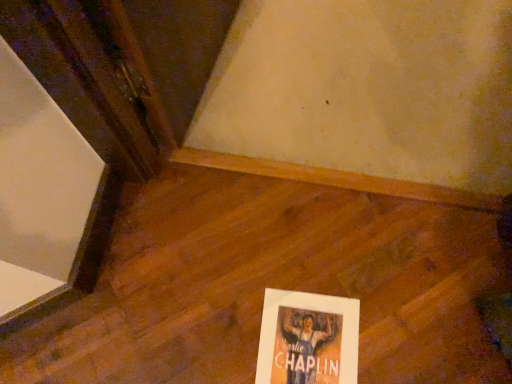
The image size is (512, 384). In order to click on vacant space behind matte paper poster at lower right in this screenshot , I will do `click(302, 254)`.